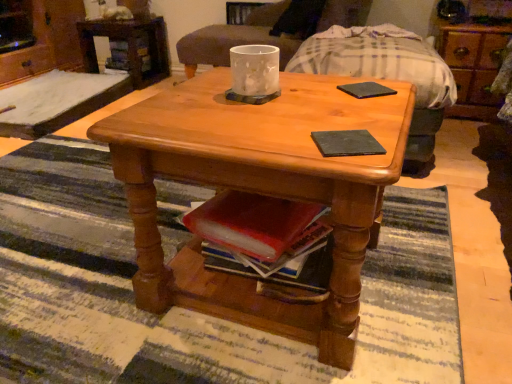
Question: Is wooden dresser at upper right, the 2th dresser viewed from the left, positioned in front of wooden desk at upper left?

Choices:
 (A) yes
 (B) no

Answer: (A)

Question: Would you say wooden dresser at upper right, the 2th dresser viewed from the left, contains wooden desk at upper left?

Choices:
 (A) yes
 (B) no

Answer: (B)

Question: Can you see wooden dresser at upper right, the first dresser in the right-to-left sequence, touching wooden desk at upper left?

Choices:
 (A) yes
 (B) no

Answer: (B)

Question: From a real-world perspective, does wooden dresser at upper right, the first dresser in the right-to-left sequence, stand above wooden desk at upper left?

Choices:
 (A) yes
 (B) no

Answer: (A)

Question: Does wooden dresser at upper right, the 2th dresser viewed from the left, have a larger size compared to wooden desk at upper left?

Choices:
 (A) no
 (B) yes

Answer: (A)

Question: From the image's perspective, is wooden dresser at upper right, the 2th dresser viewed from the left, located above or below light brown wood coffee table at center?

Choices:
 (A) above
 (B) below

Answer: (A)

Question: In terms of width, does wooden dresser at upper right, the first dresser in the right-to-left sequence, look wider or thinner when compared to light brown wood coffee table at center?

Choices:
 (A) wide
 (B) thin

Answer: (B)

Question: Considering the positions of wooden dresser at upper right, the first dresser in the right-to-left sequence, and light brown wood coffee table at center in the image, is wooden dresser at upper right, the first dresser in the right-to-left sequence, taller or shorter than light brown wood coffee table at center?

Choices:
 (A) short
 (B) tall

Answer: (A)

Question: Considering the relative positions of wooden dresser at upper right, the first dresser in the right-to-left sequence, and light brown wood coffee table at center in the image provided, is wooden dresser at upper right, the first dresser in the right-to-left sequence, to the left or to the right of light brown wood coffee table at center?

Choices:
 (A) left
 (B) right

Answer: (B)

Question: Is point (51, 44) positioned closer to the camera than point (205, 33)?

Choices:
 (A) closer
 (B) farther

Answer: (B)

Question: From the image's perspective, relative to wooden armchair at center, is brushed metal dresser at upper left, acting as the first dresser starting from the left, above or below?

Choices:
 (A) above
 (B) below

Answer: (A)

Question: Relative to wooden armchair at center, is brushed metal dresser at upper left, acting as the first dresser starting from the left, in front or behind?

Choices:
 (A) behind
 (B) front

Answer: (A)

Question: Considering the positions of brushed metal dresser at upper left, acting as the first dresser starting from the left, and wooden armchair at center in the image, is brushed metal dresser at upper left, acting as the first dresser starting from the left, taller or shorter than wooden armchair at center?

Choices:
 (A) tall
 (B) short

Answer: (A)

Question: Is matte glass candle at center in front of or behind brushed metal dresser at upper left, which appears as the 2th dresser when viewed from the right, in the image?

Choices:
 (A) behind
 (B) front

Answer: (B)

Question: From the image's perspective, is matte glass candle at center above or below brushed metal dresser at upper left, acting as the first dresser starting from the left?

Choices:
 (A) above
 (B) below

Answer: (B)